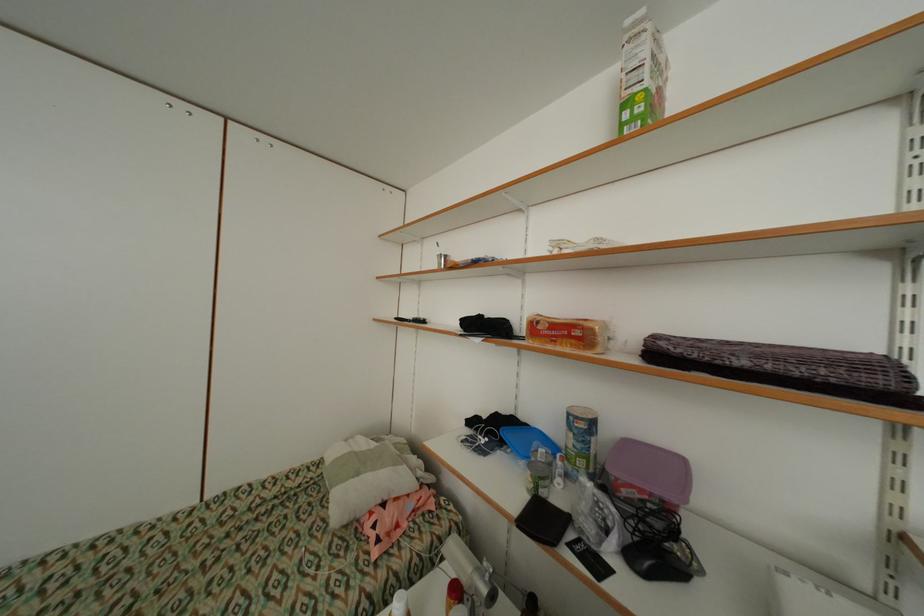
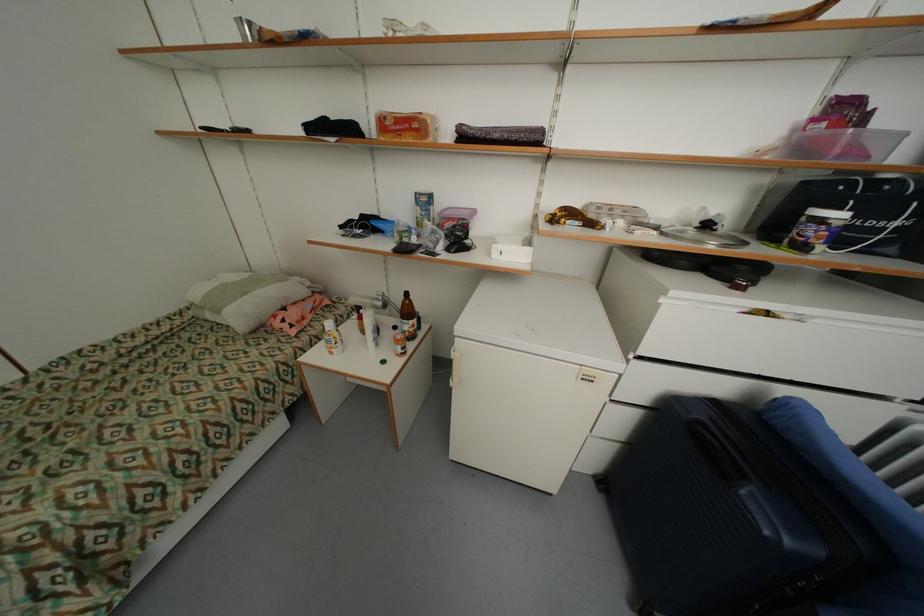
Find the pixel in the second image that matches (428,315) in the first image.

(248, 128)